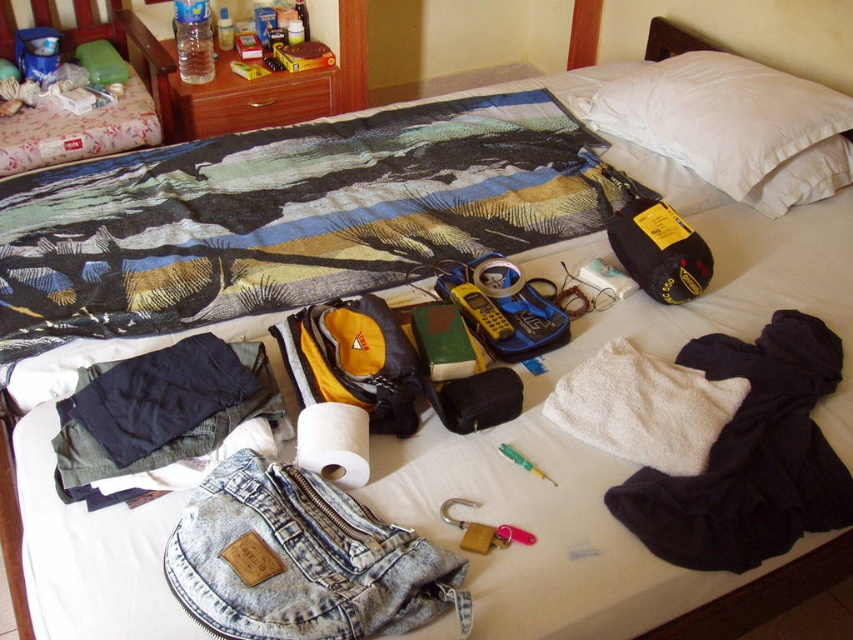
You are a delivery robot with a height of 1.3 meters. You need to place a package on the bed. The bed is in front of you. The textured cotton blanket at center is on the bed. Can you reach the bed to place the package without climbing onto anything?

The distance between the textured cotton blanket at center and the camera is 1.36 meters. Since the robot is 1.3 meters tall, it can reach the bed to place the package as the distance is slightly larger than its height, allowing it to access the bed without needing to climb.

Looking at the bed in the scene, where is the textured cotton blanket at center located relative to the yellow plastic phone at center?

The textured cotton blanket at center is to the left of the yellow plastic phone at center.